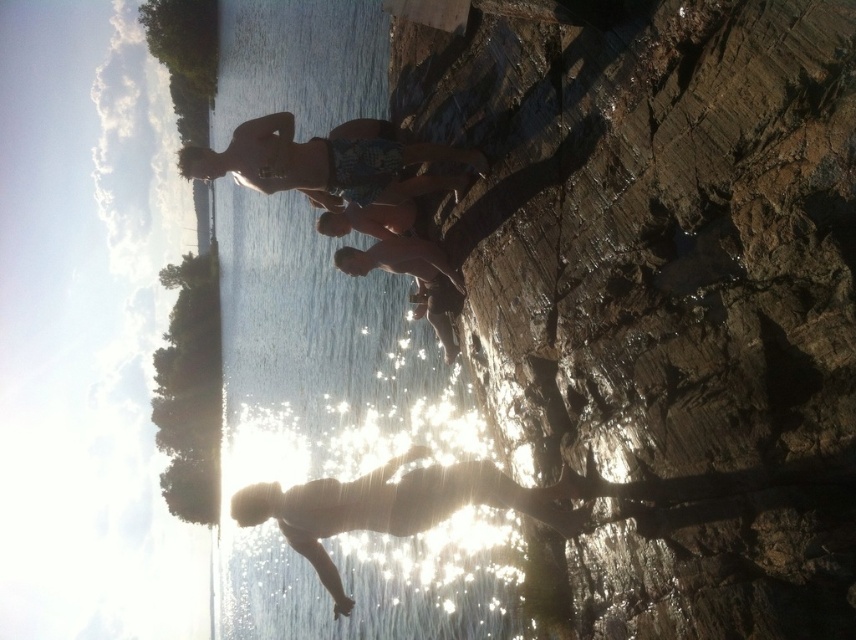
Question: Which point appears closest to the camera in this image?

Choices:
 (A) (302, 250)
 (B) (458, 492)
 (C) (526, 168)

Answer: (B)

Question: Can you confirm if brown rough rock at center is positioned below patterned swim trunks at center?

Choices:
 (A) no
 (B) yes

Answer: (B)

Question: Which point is closer to the camera?

Choices:
 (A) (667, 28)
 (B) (241, 180)
 (C) (486, 483)
 (D) (275, 276)

Answer: (A)

Question: Can you confirm if brown rough rock at center is thinner than patterned swim trunks at center?

Choices:
 (A) yes
 (B) no

Answer: (A)

Question: Which point is farther to the camera?

Choices:
 (A) (336, 579)
 (B) (366, 164)

Answer: (A)

Question: Is clear water at center closer to the viewer compared to patterned swim trunks at center?

Choices:
 (A) yes
 (B) no

Answer: (B)